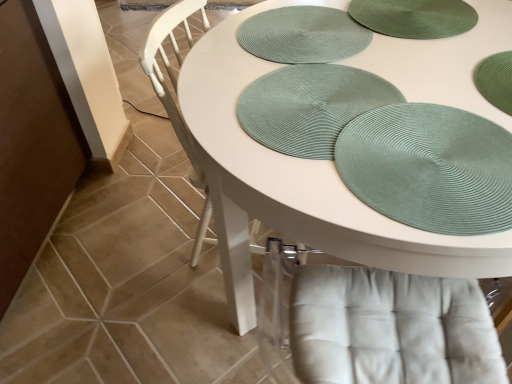
Identify the location of vacant area that lies in front of white textured chair at center. The height and width of the screenshot is (384, 512). (209, 336).